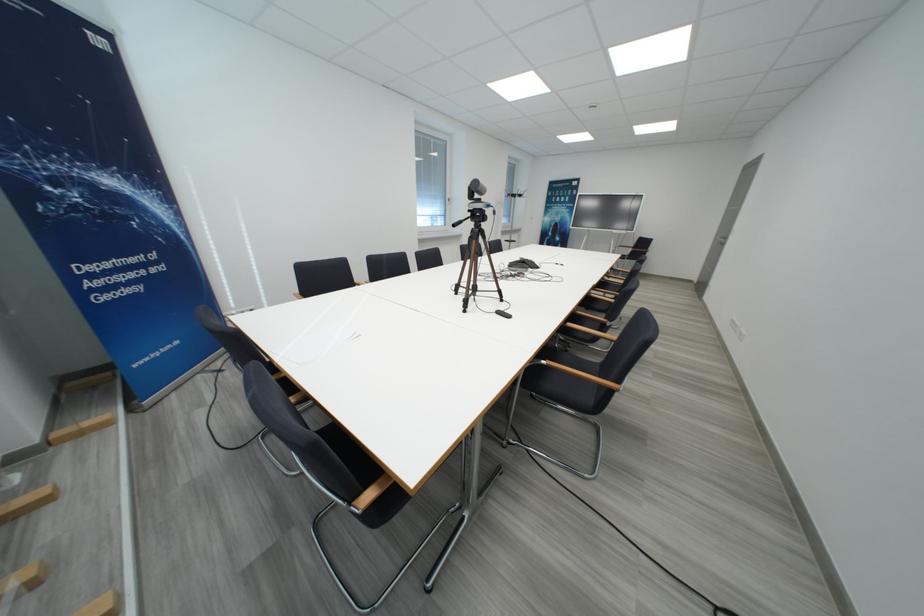
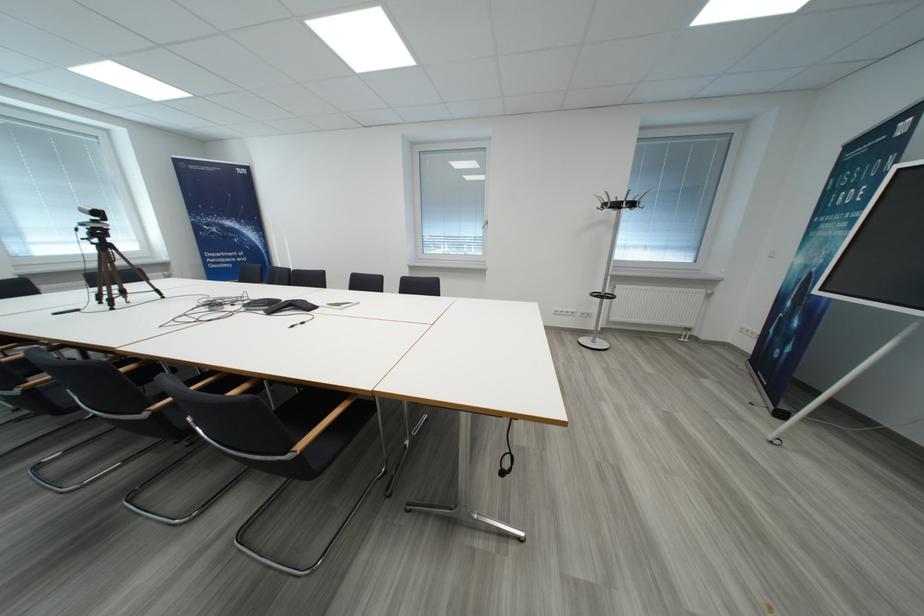
Find the pixel in the second image that matches (554,222) in the first image.

(807, 264)